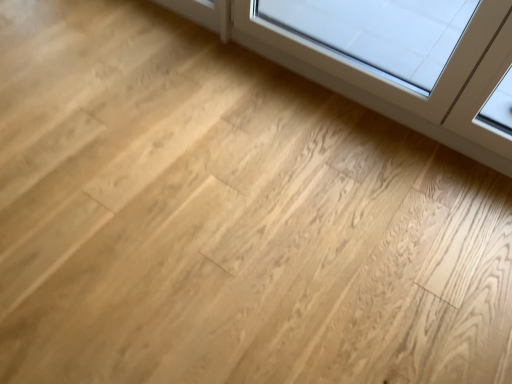
You are a GUI agent. You are given a task and a screenshot of the screen. Output one action in this format:
    pyautogui.click(x=<x>, y=<y>)
    Task: Click on the free point below transparent glass window at upper right (from a real-world perspective)
    Image resolution: width=512 pixels, height=384 pixels.
    Given the screenshot: What is the action you would take?
    pyautogui.click(x=372, y=111)